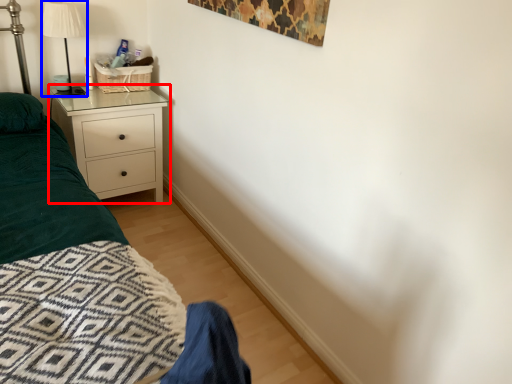
Question: Which point is closer to the camera, chest of drawers (highlighted by a red box) or lamp (highlighted by a blue box)?

Choices:
 (A) chest of drawers
 (B) lamp

Answer: (B)